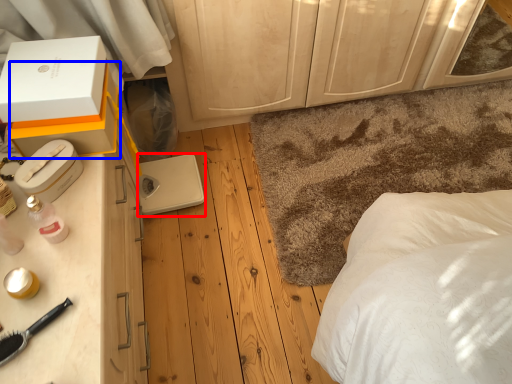
Question: Which object is closer to the camera taking this photo, appliance (highlighted by a red box) or box (highlighted by a blue box)?

Choices:
 (A) appliance
 (B) box

Answer: (B)